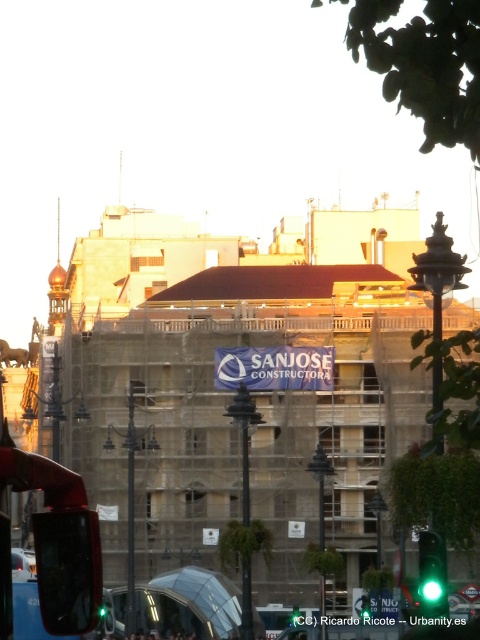
Question: Can you confirm if shiny red bus at lower left is bigger than green glass traffic light at lower right?

Choices:
 (A) no
 (B) yes

Answer: (B)

Question: Which object is farther from the camera taking this photo?

Choices:
 (A) green glass traffic light at lower right
 (B) shiny red bus at lower left

Answer: (A)

Question: Is shiny red bus at lower left to the right of green glass traffic light at lower right from the viewer's perspective?

Choices:
 (A) yes
 (B) no

Answer: (B)

Question: Among these points, which one is farthest from the camera?

Choices:
 (A) (98, 593)
 (B) (420, 563)

Answer: (B)

Question: Where is shiny red bus at lower left located in relation to green glass traffic light at lower right in the image?

Choices:
 (A) below
 (B) above

Answer: (B)